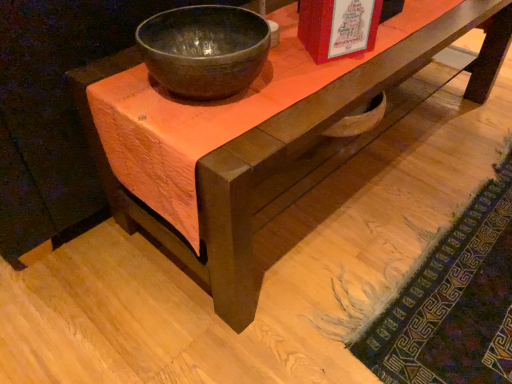
Image resolution: width=512 pixels, height=384 pixels. Find the location of `free space between matte dark gray bowl at center and matte red book at upper center`. free space between matte dark gray bowl at center and matte red book at upper center is located at coordinates (294, 71).